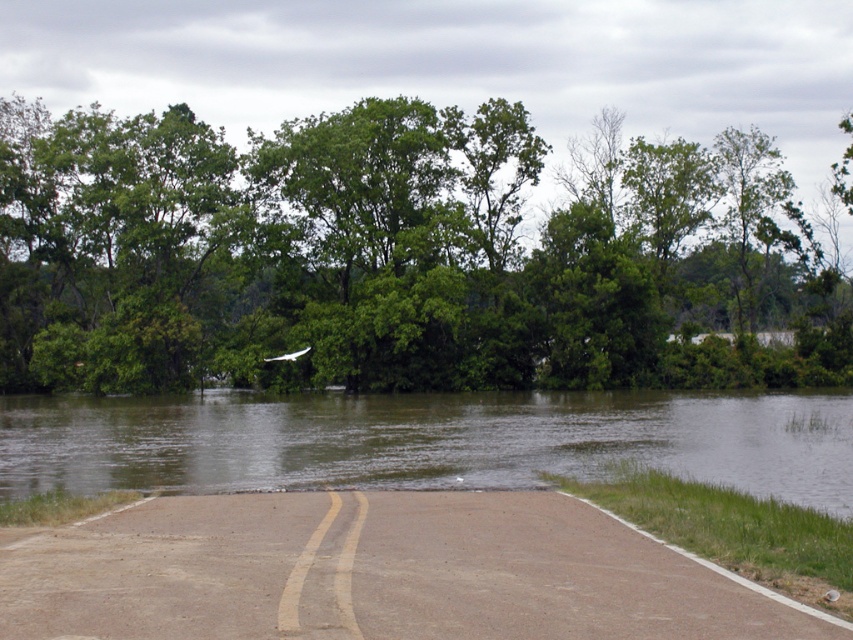
You are a hiker trying to cross the flooded road. You see the green leafy tree at upper center and the brown muddy water at center. Which object is closer to you as you stand on the road?

The green leafy tree at upper center is closer to you than the brown muddy water at center because it is further to the viewer.

You are a hiker trying to cross the flooded road. You see the green leafy tree at upper center and the brown muddy water at center. Which object is located above the other?

The green leafy tree at upper center is positioned over brown muddy water at center.